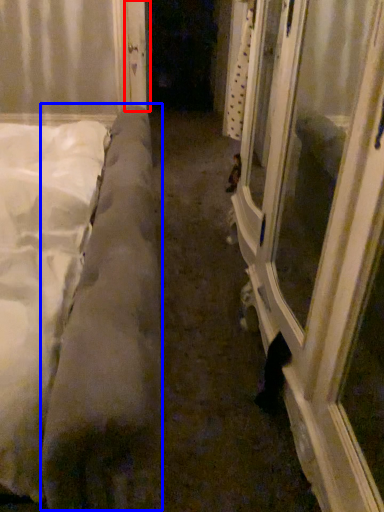
Question: Which object appears closest to the camera in this image, door (highlighted by a red box) or mattress (highlighted by a blue box)?

Choices:
 (A) door
 (B) mattress

Answer: (B)